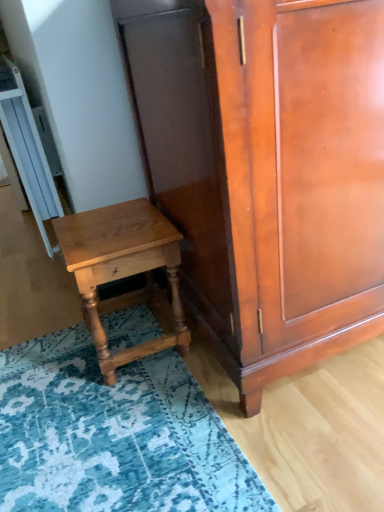
Image resolution: width=384 pixels, height=512 pixels. Find the location of `vacant point to the left of light brown wood nightstand at lower left`. vacant point to the left of light brown wood nightstand at lower left is located at coordinates (50, 365).